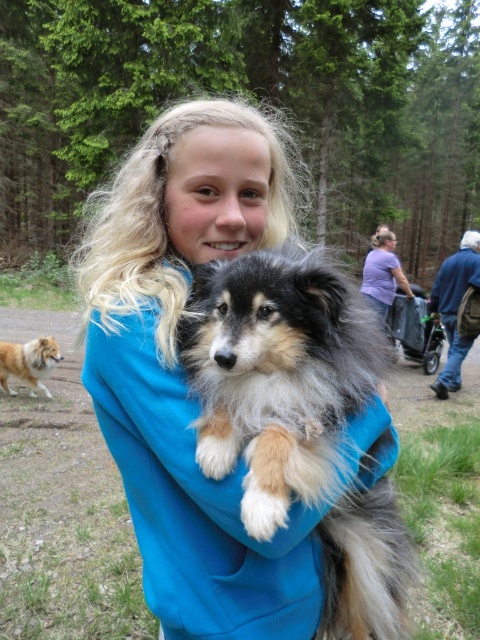
You are a fashion designer who wants to create a new line of clothing. You observe the blue soft sweater at center and the fluffy fur dog at center in the image. Which object would you consider if you want to design a garment that requires less fabric?

The blue soft sweater at center has a smaller size compared to the fluffy fur dog at center, so designing a garment based on the blue soft sweater at center would require less fabric.

You are a photographer trying to capture both the fluffy fur dog at center and the brown fluffy dog at left in the same frame. Given their sizes, which dog should you focus on first to ensure both fit in the photo?

The fluffy fur dog at center is larger in size than the brown fluffy dog at left, so you should focus on positioning the larger dog first to ensure both fit in the frame.

You are a photographer trying to capture the perfect shot of the fluffy fur dog at center and the brown fluffy dog at left. Since you want to highlight the size difference between them, which dog should you position closer to the camera to make it appear larger?

To emphasize the size difference between the fluffy fur dog at center and the brown fluffy dog at left, position the brown fluffy dog at left closer to the camera. Since the fluffy fur dog at center is taller, placing the smaller brown fluffy dog at left nearer will create a visual contrast where the closer dog appears larger despite its actual size.